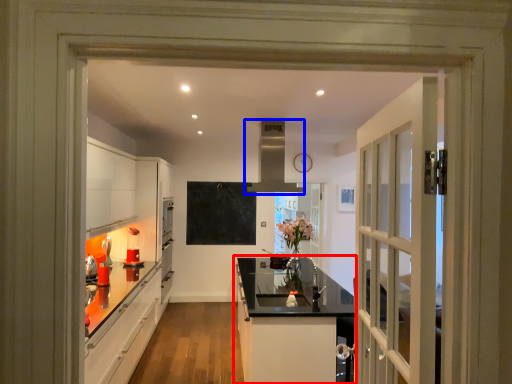
Question: Which point is closer to the camera, cabinetry (highlighted by a red box) or exhaust hood (highlighted by a blue box)?

Choices:
 (A) cabinetry
 (B) exhaust hood

Answer: (A)